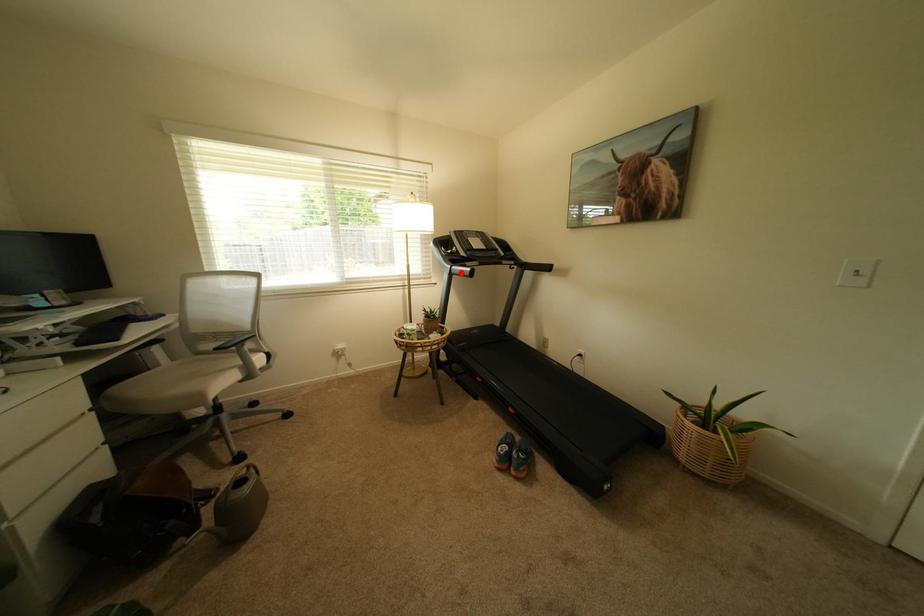
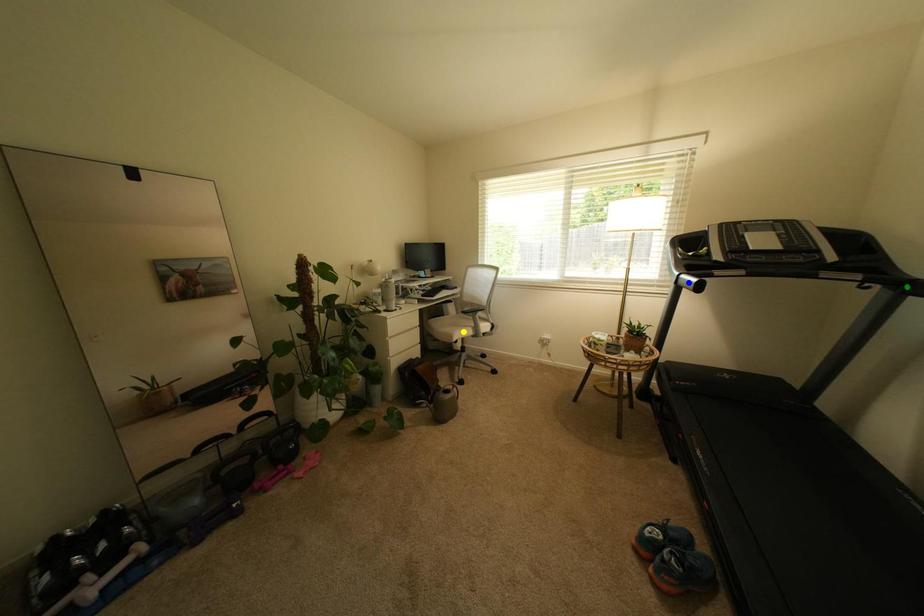
Question: I am providing you with two images of the same scene from different viewpoints. A red point is marked on the first image. You are given multiple points on the second image. Which point in image 2 is actually the same real-world point as the red point in image 1?

Choices:
 (A) blue point
 (B) yellow point
 (C) green point

Answer: (A)